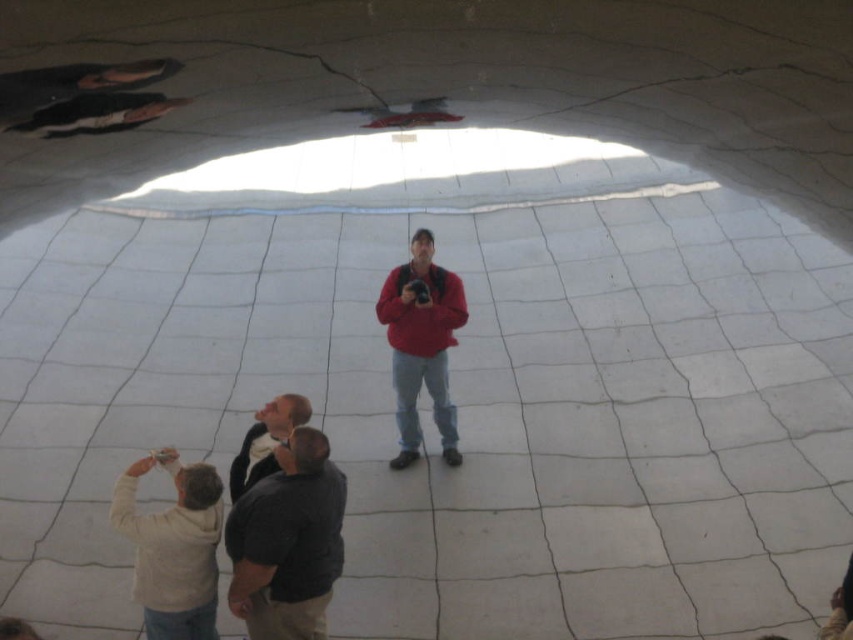
Question: Which is nearer to the dark gray sweater at lower center?

Choices:
 (A) matte red jacket at center
 (B) beige sweater at lower left

Answer: (B)

Question: Which object is farther from the camera taking this photo?

Choices:
 (A) matte red jacket at center
 (B) beige sweater at lower left
 (C) dark gray fabric at lower center
 (D) dark gray sweater at lower center

Answer: (A)

Question: Is beige sweater at lower left closer to camera compared to dark gray sweater at lower center?

Choices:
 (A) no
 (B) yes

Answer: (B)

Question: Is matte red jacket at center wider than dark gray sweater at lower center?

Choices:
 (A) yes
 (B) no

Answer: (A)

Question: Considering the real-world distances, which object is closest to the matte red jacket at center?

Choices:
 (A) beige sweater at lower left
 (B) dark gray sweater at lower center

Answer: (B)

Question: Does dark gray fabric at lower center appear on the right side of matte red jacket at center?

Choices:
 (A) no
 (B) yes

Answer: (A)